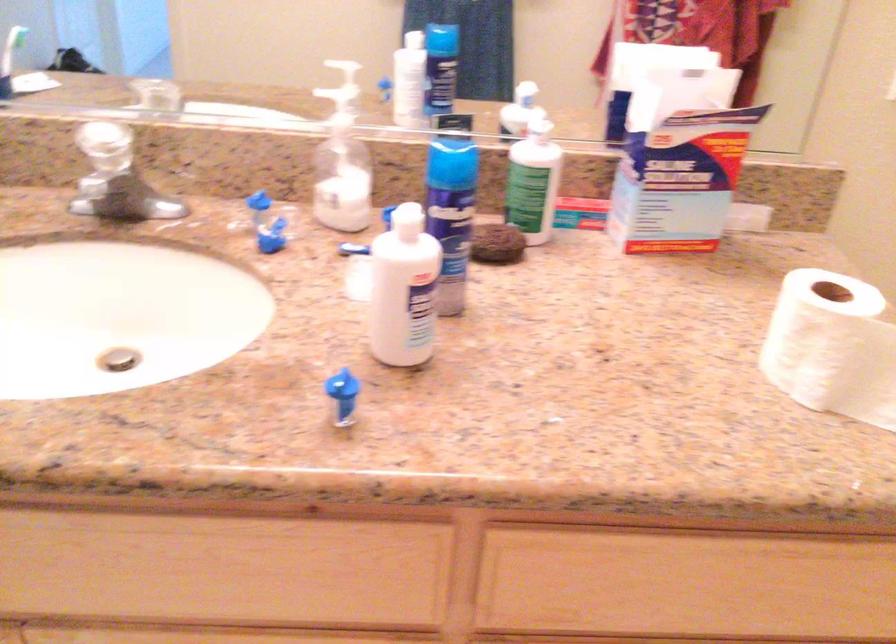
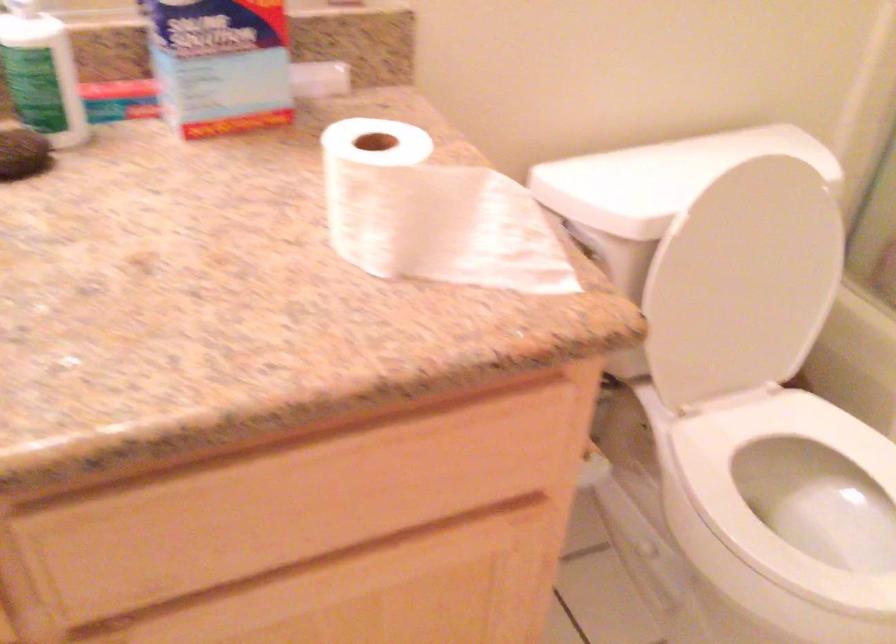
Question: The camera is either moving clockwise (left) or counter-clockwise (right) around the object. The first image is from the beginning of the video and the second image is from the end. Is the camera moving left or right when shooting the video?

Choices:
 (A) Left
 (B) Right

Answer: (A)